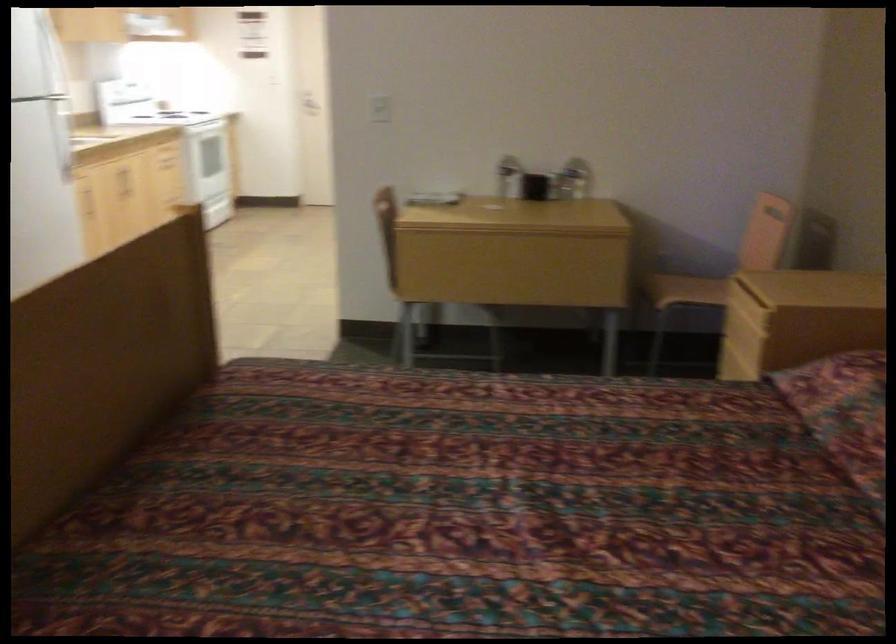
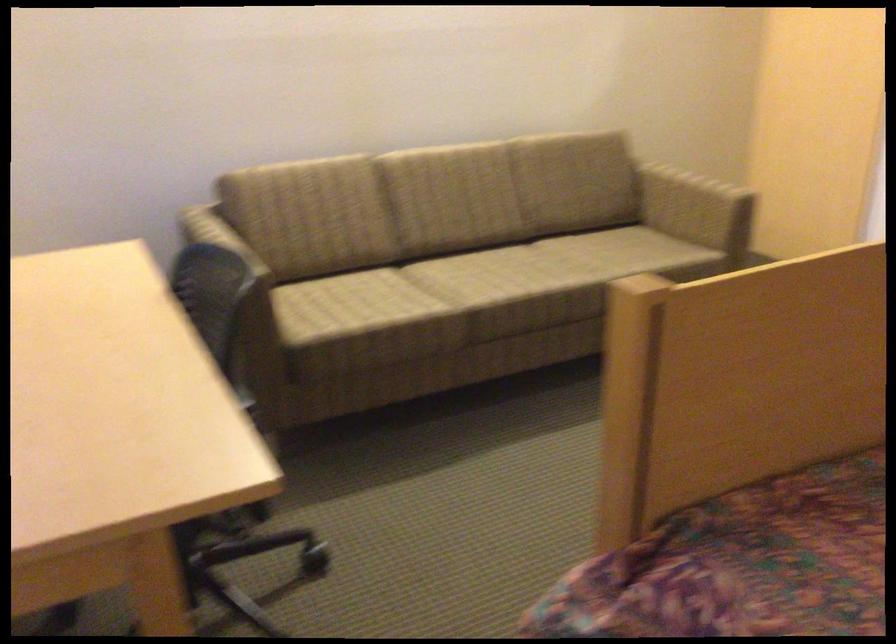
Question: Based on the continuous images, in which direction is the camera rotating? Reply with the corresponding letter.

Choices:
 (A) Left
 (B) Right
 (C) Up
 (D) Down

Answer: (A)